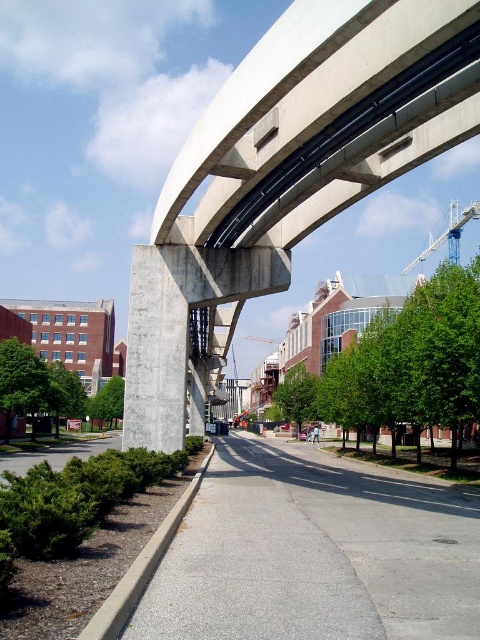
Question: In this image, where is concrete/smooth overpass at upper center located relative to gray asphalt sidewalk at center?

Choices:
 (A) right
 (B) left

Answer: (B)

Question: Does gray asphalt sidewalk at center have a larger size compared to white metallic crane at upper right?

Choices:
 (A) yes
 (B) no

Answer: (B)

Question: Which point is closer to the camera?

Choices:
 (A) (219, 349)
 (B) (458, 221)

Answer: (A)

Question: Is concrete pillar at center wider than white metallic crane at upper right?

Choices:
 (A) no
 (B) yes

Answer: (A)

Question: Which point is farther to the camera?

Choices:
 (A) concrete pillar at center
 (B) gray asphalt sidewalk at center
 (C) concrete/smooth overpass at upper center

Answer: (A)

Question: Which point is closer to the camera taking this photo?

Choices:
 (A) (148, 285)
 (B) (235, 467)

Answer: (A)